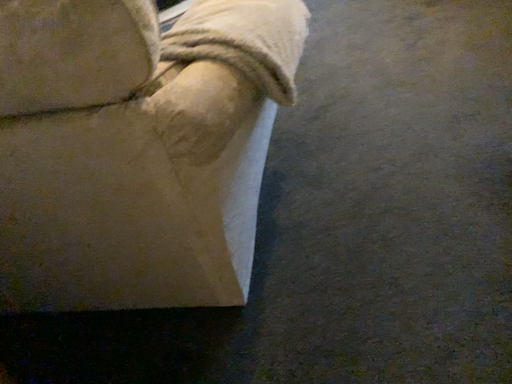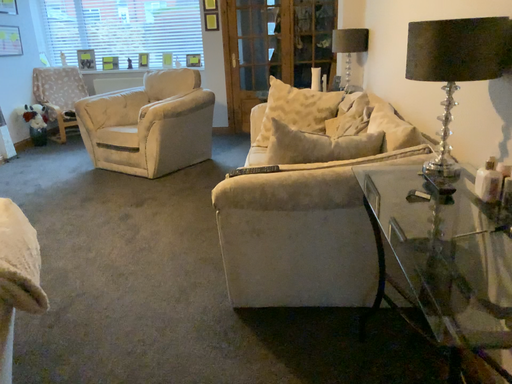
Question: How did the camera likely rotate when shooting the video?

Choices:
 (A) rotated downward
 (B) rotated upward

Answer: (B)